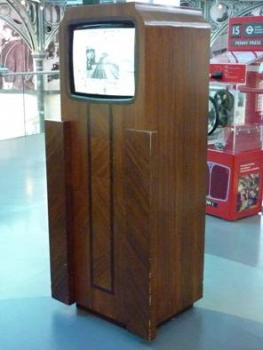
Identify the location of poster/sign. Image resolution: width=263 pixels, height=350 pixels. (249, 191).